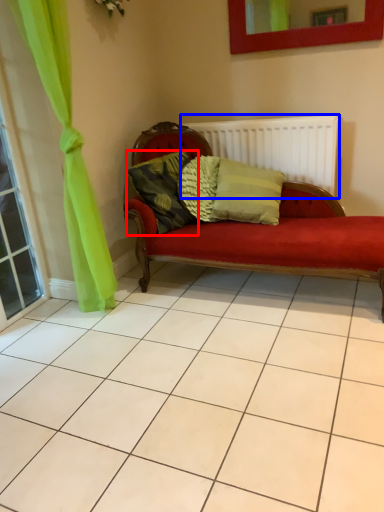
Question: Which object is closer to the camera taking this photo, pillow (highlighted by a red box) or radiator (highlighted by a blue box)?

Choices:
 (A) pillow
 (B) radiator

Answer: (A)